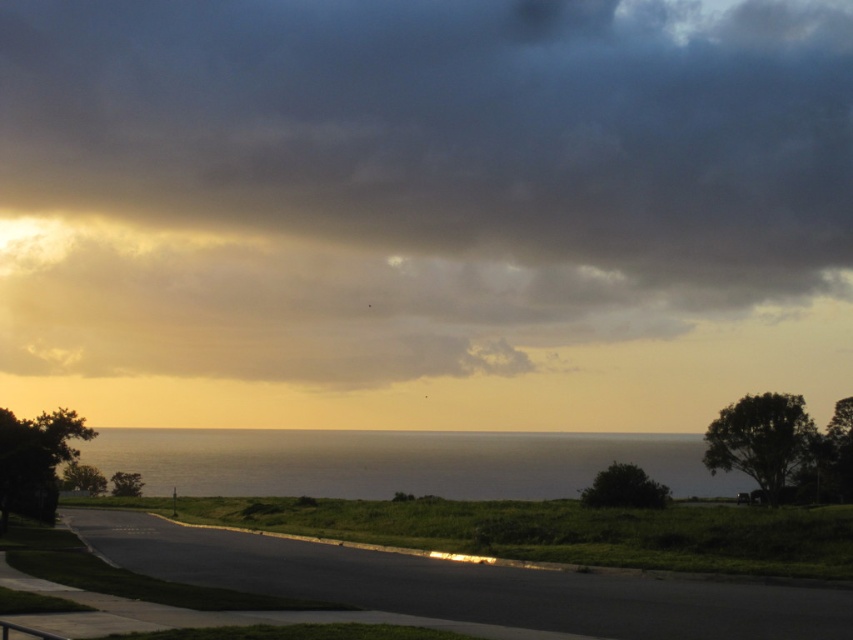
Question: Is dark gray cloud at upper center positioned behind olive green water at center?

Choices:
 (A) yes
 (B) no

Answer: (A)

Question: From the image, what is the correct spatial relationship of dark gray cloud at upper center in relation to olive green water at center?

Choices:
 (A) below
 (B) above

Answer: (B)

Question: Can you confirm if dark gray cloud at upper center is positioned below olive green water at center?

Choices:
 (A) yes
 (B) no

Answer: (B)

Question: Which of the following is the farthest from the observer?

Choices:
 (A) olive green water at center
 (B) dark gray cloud at upper center

Answer: (B)

Question: Which of the following is the farthest from the observer?

Choices:
 (A) (581, 433)
 (B) (410, 284)

Answer: (B)